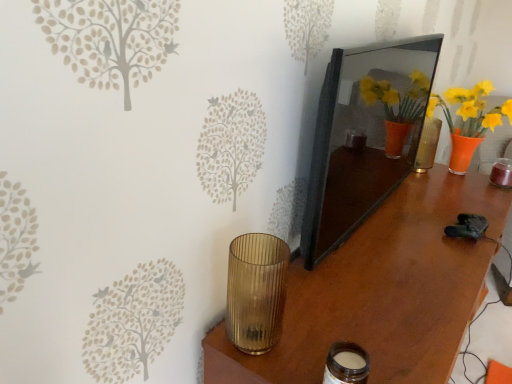
I want to click on vacant space in matte black mirror at center (from a real-world perspective), so click(366, 217).